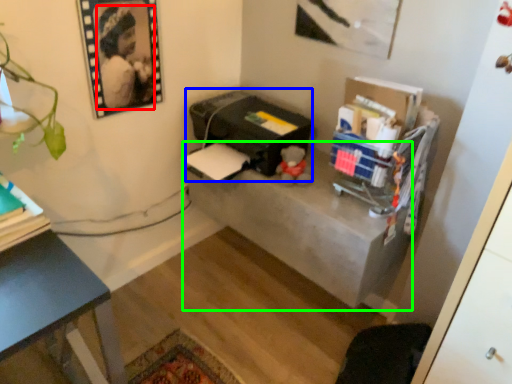
Question: Estimate the real-world distances between objects in this image. Which object is farther from person (highlighted by a red box), printer (highlighted by a blue box) or table (highlighted by a green box)?

Choices:
 (A) printer
 (B) table

Answer: (B)